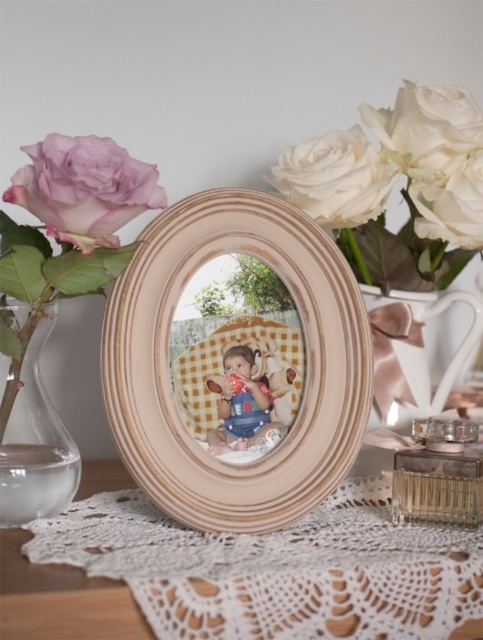
Is point (375, 339) behind point (258, 440)?

Yes, point (375, 339) is behind point (258, 440).

Who is more distant from viewer, [418,296] or [216,442]?

Positioned behind is point [418,296].

Identify the location of white porcelain vase at upper right. The height and width of the screenshot is (640, 483). (411, 352).

What do you see at coordinates (336, 179) in the screenshot? This screenshot has width=483, height=640. I see `white matte rose at upper right` at bounding box center [336, 179].

Is white matte rose at upper right shorter than clear glass perfume at center?

No, white matte rose at upper right is not shorter than clear glass perfume at center.

Is point (299, 145) positioned after point (454, 520)?

Yes, it is behind point (454, 520).

You are a GUI agent. You are given a task and a screenshot of the screen. Output one action in this format:
    pyautogui.click(x=<x>, y=<y>)
    Task: Click on the white matte rose at upper right
    
    Given the screenshot: What is the action you would take?
    pyautogui.click(x=336, y=179)

Who is positioned more to the right, wooden frame at center or white lace doily at center?

wooden frame at center is more to the right.

Is point (164, 228) farther from camera compared to point (123, 628)?

Yes, point (164, 228) is farther from viewer.

Find the location of a particular element. The height and width of the screenshot is (640, 483). wooden frame at center is located at coordinates (169, 372).